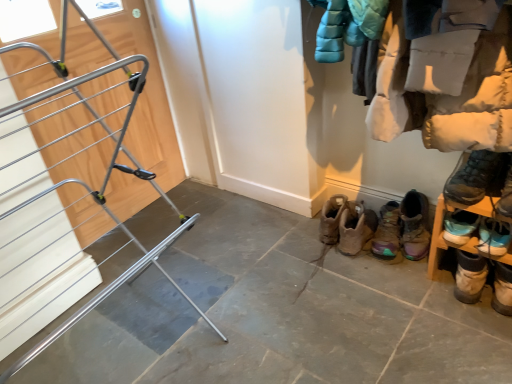
What is the approximate height of dark gray suede boot at lower right, the fourth footwear when ordered from left to right?

The height of dark gray suede boot at lower right, the fourth footwear when ordered from left to right, is 7.21 inches.

Where is `light brown suede boot at lower right, the 2th footwear in the right-to-left sequence`? light brown suede boot at lower right, the 2th footwear in the right-to-left sequence is located at coordinates click(x=470, y=277).

This screenshot has height=384, width=512. Describe the element at coordinates (387, 232) in the screenshot. I see `camouflage fabric boot at lower center, acting as the second footwear starting from the left` at that location.

Image resolution: width=512 pixels, height=384 pixels. Find the location of `white fluffy coat at upper right`. white fluffy coat at upper right is located at coordinates (450, 95).

Identify the location of blue suede sneakers at lower right, marked as the 6th footwear in a left-to-right arrangement. (493, 237).

Where is `closet behind the gray stone floor at center`? This screenshot has height=384, width=512. closet behind the gray stone floor at center is located at coordinates (450, 95).

Is gray stone floor at center not within white fluffy coat at upper right?

Absolutely, gray stone floor at center is external to white fluffy coat at upper right.

Measure the distance from gray stone floor at center to white fluffy coat at upper right.

gray stone floor at center and white fluffy coat at upper right are 30.18 inches apart from each other.

Looking at the image, does gray stone floor at center seem bigger or smaller compared to white fluffy coat at upper right?

In the image, gray stone floor at center appears to be smaller than white fluffy coat at upper right.

Considering the relative positions of camouflage fabric boot at lower center, acting as the second footwear starting from the left, and blue suede sneakers at lower right, marked as the 6th footwear in a left-to-right arrangement, in the image provided, is camouflage fabric boot at lower center, acting as the second footwear starting from the left, to the left of blue suede sneakers at lower right, marked as the 6th footwear in a left-to-right arrangement, from the viewer's perspective?

Indeed, camouflage fabric boot at lower center, acting as the second footwear starting from the left, is positioned on the left side of blue suede sneakers at lower right, marked as the 6th footwear in a left-to-right arrangement.

Is there a large distance between camouflage fabric boot at lower center, which is counted as the 5th footwear, starting from the right, and blue suede sneakers at lower right, the 1th footwear viewed from the right?

No, there isn't a large distance between camouflage fabric boot at lower center, which is counted as the 5th footwear, starting from the right, and blue suede sneakers at lower right, the 1th footwear viewed from the right.

Considering the sizes of objects camouflage fabric boot at lower center, acting as the second footwear starting from the left, and blue suede sneakers at lower right, the 1th footwear viewed from the right, in the image provided, who is thinner, camouflage fabric boot at lower center, acting as the second footwear starting from the left, or blue suede sneakers at lower right, the 1th footwear viewed from the right,?

blue suede sneakers at lower right, the 1th footwear viewed from the right.

Would you say camouflage fabric boot at lower center, acting as the second footwear starting from the left, is inside or outside blue suede sneakers at lower right, marked as the 6th footwear in a left-to-right arrangement?

The correct answer is: outside.

Is camouflage fabric boot at lower center, which is counted as the 5th footwear, starting from the right, not near silver metallic drying rack at left?

camouflage fabric boot at lower center, which is counted as the 5th footwear, starting from the right, is positioned a significant distance from silver metallic drying rack at left.

Is camouflage fabric boot at lower center, which is counted as the 5th footwear, starting from the right, thinner than silver metallic drying rack at left?

Indeed, camouflage fabric boot at lower center, which is counted as the 5th footwear, starting from the right, has a lesser width compared to silver metallic drying rack at left.

Is camouflage fabric boot at lower center, acting as the second footwear starting from the left, bigger than silver metallic drying rack at left?

No, camouflage fabric boot at lower center, acting as the second footwear starting from the left, is not bigger than silver metallic drying rack at left.

Is the depth of camouflage fabric boot at lower center, which is counted as the 5th footwear, starting from the right, less than that of dark gray suede boot at lower right, placed as the third footwear when sorted from right to left?

No, it is not.

This screenshot has height=384, width=512. There is a camouflage fabric boot at lower center, acting as the second footwear starting from the left. Find the location of `the 4th footwear above it (from a real-world perspective)`. the 4th footwear above it (from a real-world perspective) is located at coordinates (481, 178).

Does camouflage fabric boot at lower center, acting as the second footwear starting from the left, have a smaller size compared to dark gray suede boot at lower right, the fourth footwear when ordered from left to right?

Correct, camouflage fabric boot at lower center, acting as the second footwear starting from the left, occupies less space than dark gray suede boot at lower right, the fourth footwear when ordered from left to right.

Does camouflage fabric boot at lower center, acting as the second footwear starting from the left, turn towards dark gray suede boot at lower right, the fourth footwear when ordered from left to right?

No.

Who is taller, silver metallic drying rack at left or blue suede sneakers at lower right, the 1th footwear viewed from the right?

silver metallic drying rack at left is taller.

From a real-world perspective, between silver metallic drying rack at left and blue suede sneakers at lower right, marked as the 6th footwear in a left-to-right arrangement, who is vertically lower?

From a 3D spatial view, blue suede sneakers at lower right, marked as the 6th footwear in a left-to-right arrangement, is below.

Is silver metallic drying rack at left oriented away from blue suede sneakers at lower right, marked as the 6th footwear in a left-to-right arrangement?

No.

Do you think silver metallic drying rack at left is within blue suede sneakers at lower right, the 1th footwear viewed from the right, or outside of it?

silver metallic drying rack at left is outside blue suede sneakers at lower right, the 1th footwear viewed from the right.

Is point (483, 236) farther from viewer compared to point (73, 140)?

No, it is not.

From the image's perspective, which one is positioned lower, blue suede sneakers at lower right, the 1th footwear viewed from the right, or silver metallic drying rack at left?

From the image's view, blue suede sneakers at lower right, the 1th footwear viewed from the right, is below.

Is blue suede sneakers at lower right, the 1th footwear viewed from the right, oriented towards silver metallic drying rack at left?

No.

The image size is (512, 384). In order to click on furniture that appears above the blue suede sneakers at lower right, the 1th footwear viewed from the right (from the image's perspective) in this screenshot , I will do `click(74, 173)`.

Does camouflage fabric boot at lower center, which is counted as the 5th footwear, starting from the right, have a lesser width compared to light brown suede boot at lower right, the fifth footwear when ordered from left to right?

No.

Is camouflage fabric boot at lower center, which is counted as the 5th footwear, starting from the right, facing towards light brown suede boot at lower right, the fifth footwear when ordered from left to right?

No.

Between camouflage fabric boot at lower center, which is counted as the 5th footwear, starting from the right, and light brown suede boot at lower right, the 2th footwear in the right-to-left sequence, which one appears on the right side from the viewer's perspective?

light brown suede boot at lower right, the 2th footwear in the right-to-left sequence.

From a real-world perspective, which object rests below the other?

light brown suede boot at lower right, the 2th footwear in the right-to-left sequence.

At what (x,y) coordinates should I click in order to perform the action: click on closet behind the gray stone floor at center. Please return your answer as a coordinate pair (x, y). This screenshot has width=512, height=384. Looking at the image, I should click on (450, 95).

Where is `footwear that is the 2nd one when counting downward from the blue suede sneakers at lower right, marked as the 6th footwear in a left-to-right arrangement (from the image's perspective)`? footwear that is the 2nd one when counting downward from the blue suede sneakers at lower right, marked as the 6th footwear in a left-to-right arrangement (from the image's perspective) is located at coordinates (387, 232).

Which object lies further to the anchor point gray stone floor at center, light brown suede boot at lower right, the fifth footwear when ordered from left to right, or white fluffy coat at upper right?

white fluffy coat at upper right is positioned further to the anchor gray stone floor at center.

Considering their positions, is dark gray suede boot at lower right, placed as the third footwear when sorted from right to left, positioned further to brown suede boot at lower right, which is counted as the sixth footwear, starting from the right, than blue suede sneakers at lower right, the 1th footwear viewed from the right?

blue suede sneakers at lower right, the 1th footwear viewed from the right, is positioned further to the anchor brown suede boot at lower right, which is counted as the sixth footwear, starting from the right.

Considering their positions, is blue suede sneakers at lower right, the 1th footwear viewed from the right, positioned closer to white fluffy coat at upper right than brown suede boot at lower right, which is the 1th footwear from left to right?

The object closer to white fluffy coat at upper right is blue suede sneakers at lower right, the 1th footwear viewed from the right.

When comparing their distances from blue suede sneakers at lower right, marked as the 6th footwear in a left-to-right arrangement, does brown suede boot at lower right, which is counted as the sixth footwear, starting from the right, or light brown suede boot at lower right, the 2th footwear in the right-to-left sequence, seem closer?

Among the two, light brown suede boot at lower right, the 2th footwear in the right-to-left sequence, is located nearer to blue suede sneakers at lower right, marked as the 6th footwear in a left-to-right arrangement.

From the image, which object appears to be nearer to multicolored suede boot at lower right, placed as the third footwear when sorted from left to right, dark gray suede boot at lower right, the fourth footwear when ordered from left to right, or wooden shoe rack at lower right?

wooden shoe rack at lower right is closer to multicolored suede boot at lower right, placed as the third footwear when sorted from left to right.

Considering their positions, is dark gray suede boot at lower right, placed as the third footwear when sorted from right to left, positioned closer to silver metallic drying rack at left than wooden shoe rack at lower right?

A: The object closer to silver metallic drying rack at left is wooden shoe rack at lower right.

Considering their positions, is gray stone floor at center positioned further to multicolored suede boot at lower right, placed as the third footwear when sorted from left to right, than dark gray suede boot at lower right, placed as the third footwear when sorted from right to left?

Based on the image, gray stone floor at center appears to be further to multicolored suede boot at lower right, placed as the third footwear when sorted from left to right.

From the image, which object appears to be farther from gray stone floor at center, silver metallic drying rack at left or blue suede sneakers at lower right, the 1th footwear viewed from the right?

Among the two, blue suede sneakers at lower right, the 1th footwear viewed from the right, is located further to gray stone floor at center.

At what (x,y) coordinates should I click in order to perform the action: click on footwear between white fluffy coat at upper right and blue suede sneakers at lower right, the 1th footwear viewed from the right, from front to back. Please return your answer as a coordinate pair (x, y). Image resolution: width=512 pixels, height=384 pixels. Looking at the image, I should click on (481, 178).

The width and height of the screenshot is (512, 384). I want to click on shelf between gray stone floor at center and blue suede sneakers at lower right, the 1th footwear viewed from the right, in the horizontal direction, so click(469, 239).

In order to click on closet between silver metallic drying rack at left and camouflage fabric boot at lower center, which is counted as the 5th footwear, starting from the right in this screenshot , I will do `click(450, 95)`.

At what (x,y) coordinates should I click in order to perform the action: click on shelf between white fluffy coat at upper right and brown suede boot at lower right, which is counted as the sixth footwear, starting from the right, in the front-back direction. Please return your answer as a coordinate pair (x, y). Looking at the image, I should click on (469, 239).